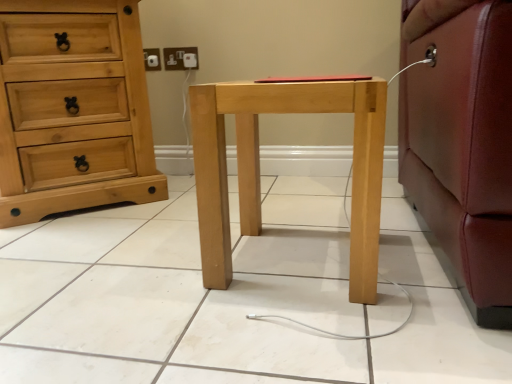
Locate an element on the screen. The width and height of the screenshot is (512, 384). free space behind natural wood nightstand at center is located at coordinates (302, 213).